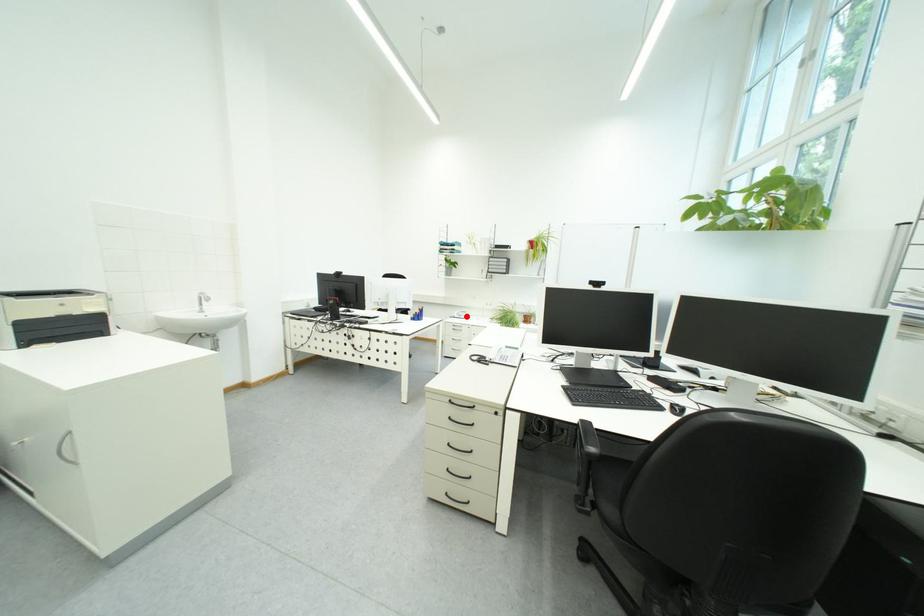
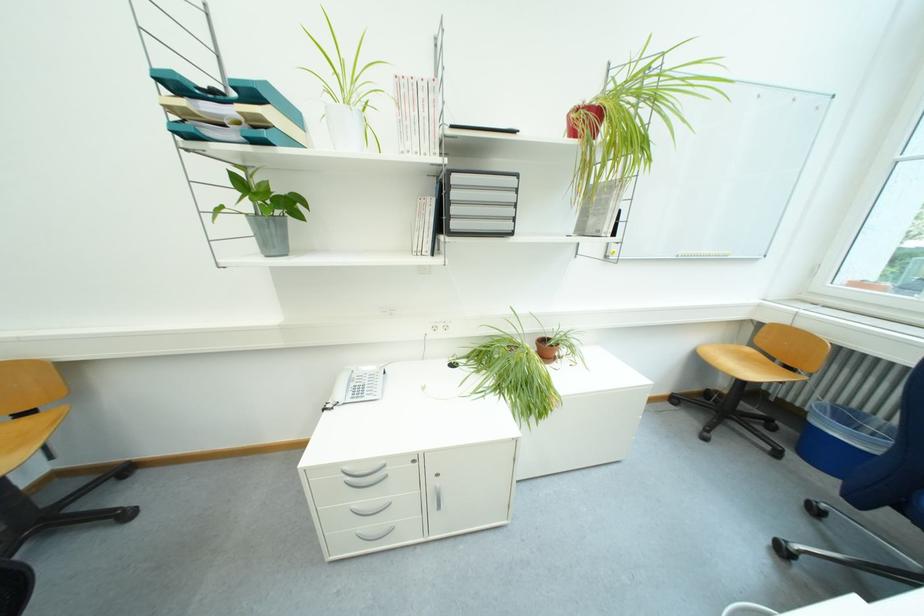
Find the pixel in the second image that matches the highlighted location in the first image.

(351, 395)